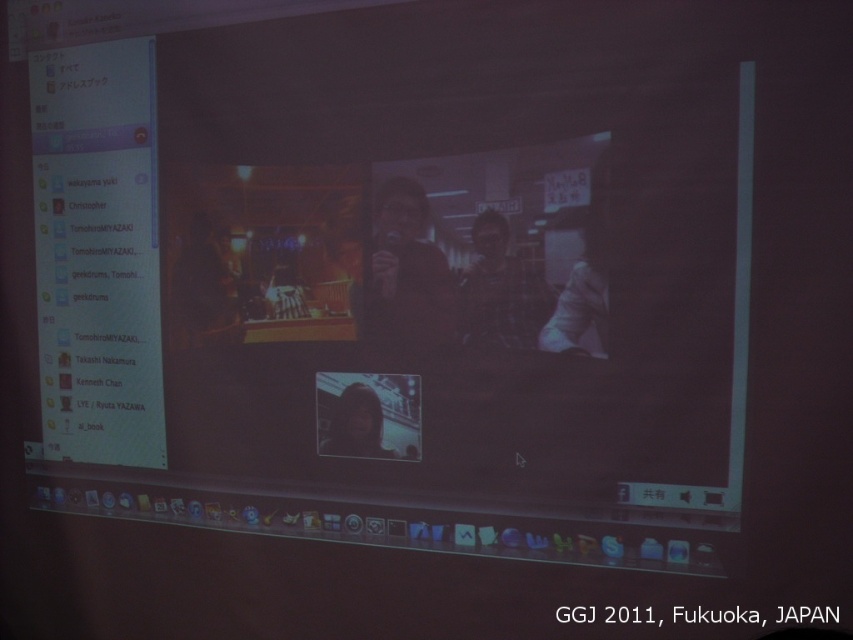
You are standing in front of a computer screen showing a video call. There is a point marked at coordinates point [196,301]. If you want to move closer to the camera that captured the video feed, should you move towards or away from this point?

The point [196,301] is 8.07 feet from the camera. To move closer to the camera, you should move towards this point since it is located at a distance closer than your current position if you are on the screen.

You are setting up audio equipment for a live event. You have two microphones on the table in front of you, a matte black microphone at center and a dark fabric microphone at center. The venue requires the taller microphone to be placed closer to the speaker. Which microphone should you position closer to the speaker?

The matte black microphone at center is much taller than the dark fabric microphone at center, so you should position the matte black microphone at center closer to the speaker.

You are organizing a virtual event and need to position two interactive elements on the screen. The first element should be placed at point (229, 266) and the second at point (358, 444). Based on the screen layout, which point is closer to the bottom edge of the screen?

Point (358, 444) is closer to the bottom edge of the screen because it is positioned below point (229, 266).